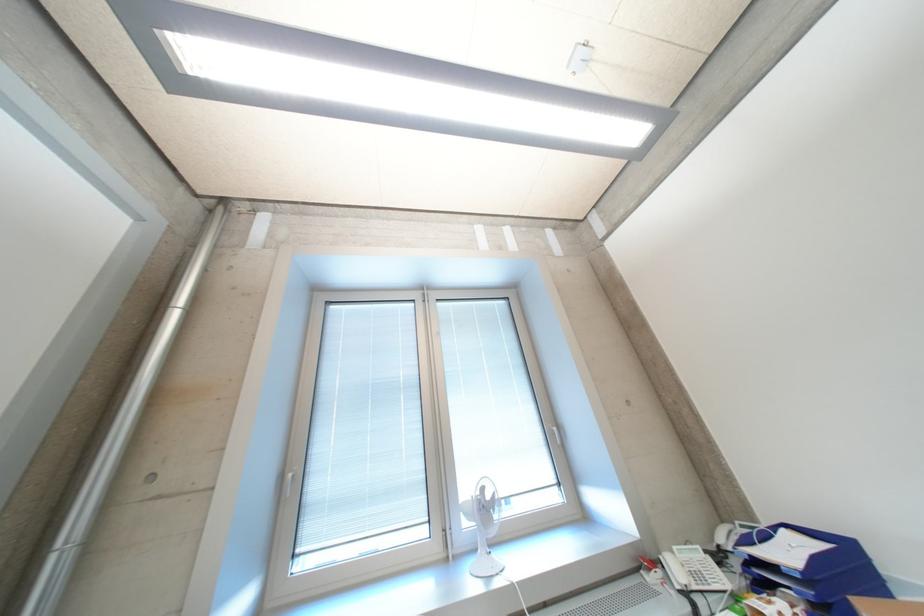
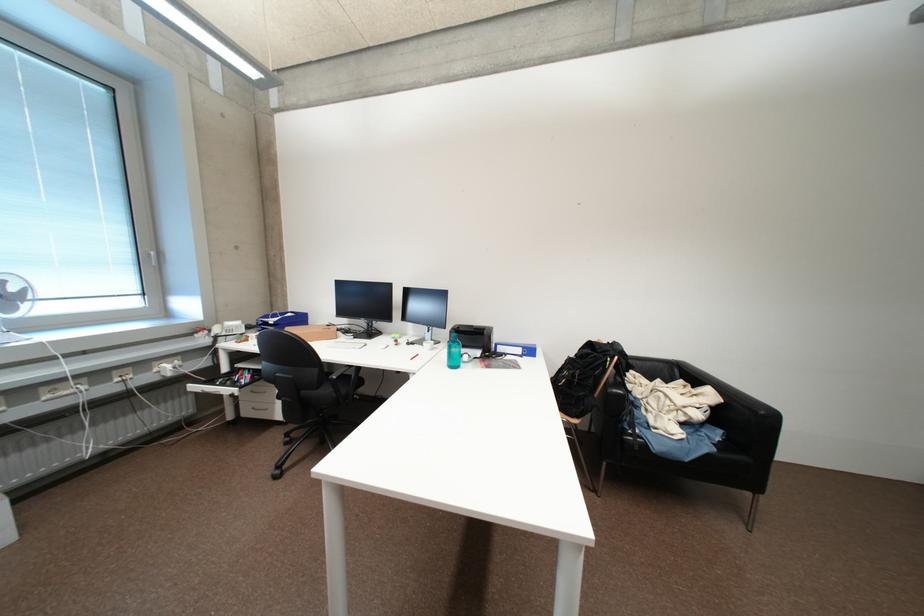
In the second image, find the point that corresponds to the point at 686,575 in the first image.

(225, 331)